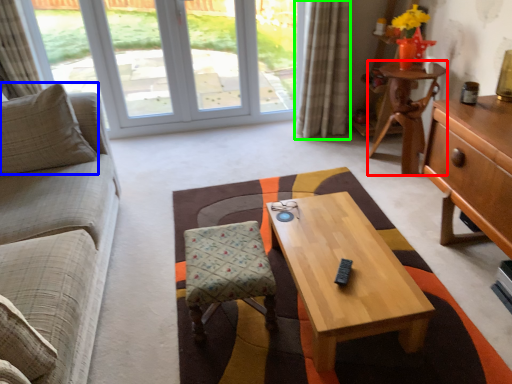
Question: Based on their relative distances, which object is nearer to desk (highlighted by a red box)? Choose from pillow (highlighted by a blue box) and curtain (highlighted by a green box).

Choices:
 (A) pillow
 (B) curtain

Answer: (B)